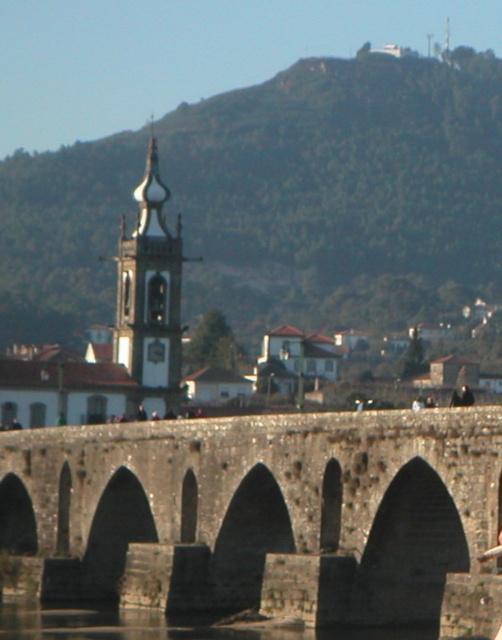
Who is more forward, (168, 420) or (143, 637)?

Positioned in front is point (143, 637).

Can you confirm if stone arch bridge at center is thinner than clear water at bridge center?

In fact, stone arch bridge at center might be wider than clear water at bridge center.

Does point (179, 522) come farther from viewer compared to point (404, 637)?

Yes, point (179, 522) is farther from viewer.

Where is `stone arch bridge at center`? The width and height of the screenshot is (502, 640). stone arch bridge at center is located at coordinates (263, 515).